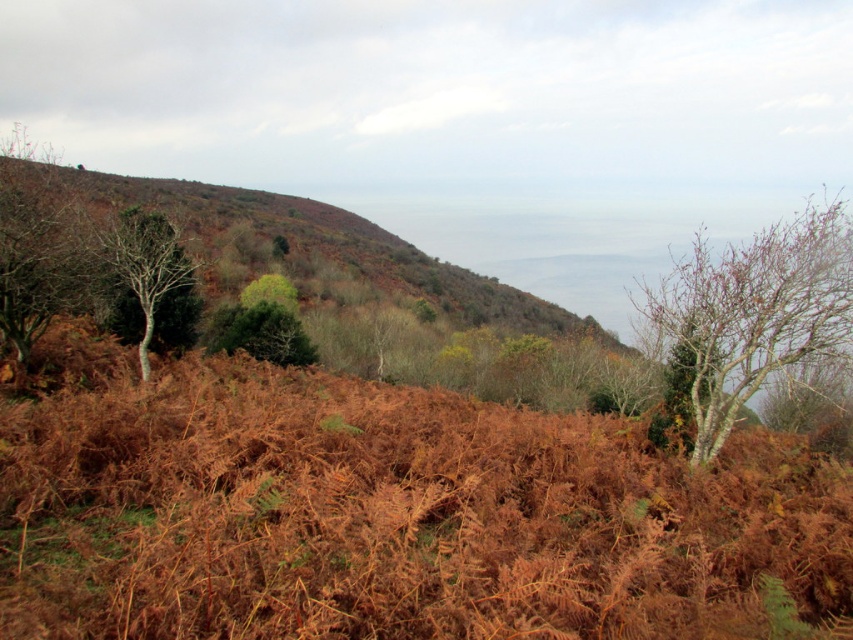
The width and height of the screenshot is (853, 640). Describe the element at coordinates (314, 244) in the screenshot. I see `brown/dry grass at left` at that location.

Between point (199, 253) and point (181, 268), which one is positioned in front?

Positioned in front is point (181, 268).

The image size is (853, 640). I want to click on brown/dry grass at left, so coord(314,244).

Does bare wood tree at right appear over brown/dry grass at left?

Yes.

Describe the element at coordinates (755, 310) in the screenshot. I see `bare wood tree at right` at that location.

Locate an element on the screen. The height and width of the screenshot is (640, 853). bare wood tree at right is located at coordinates (755, 310).

Does bare wood tree at right appear under green matte tree at left?

Actually, bare wood tree at right is above green matte tree at left.

How far apart are bare wood tree at right and green matte tree at left?

bare wood tree at right and green matte tree at left are 49.50 feet apart from each other.

Between point (669, 307) and point (149, 268), which one is positioned in front?

Positioned in front is point (669, 307).

You are a GUI agent. You are given a task and a screenshot of the screen. Output one action in this format:
    pyautogui.click(x=<x>, y=<y>)
    Task: Click on the bare wood tree at right
    This screenshot has width=853, height=640.
    Given the screenshot: What is the action you would take?
    pyautogui.click(x=755, y=310)